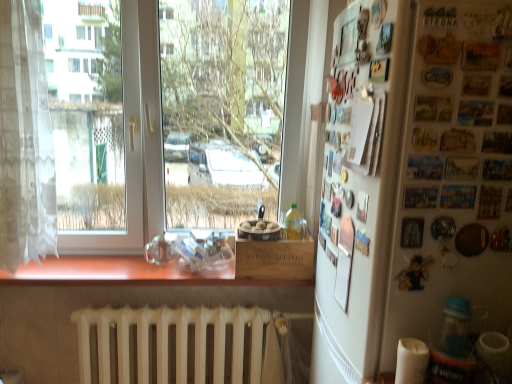
Question: Choose the correct answer: Is translucent plastic bottle at lower right, the 2th bottle when ordered from back to front, inside yellow translucent bottle at center, which is the second bottle in front-to-back order, or outside it?

Choices:
 (A) outside
 (B) inside

Answer: (A)

Question: From a real-world perspective, relative to yellow translucent bottle at center, marked as the first bottle in a back-to-front arrangement, is translucent plastic bottle at lower right, the first bottle positioned from the right, vertically above or below?

Choices:
 (A) below
 (B) above

Answer: (A)

Question: Which object is positioned farthest from the transparent glass window at center?

Choices:
 (A) white matte radiator at lower center
 (B) white matte refrigerator at right
 (C) translucent plastic bottle at lower right, the first bottle from the front
 (D) metallic silver magnets at right
 (E) white lace curtain at left

Answer: (C)

Question: Estimate the real-world distances between objects in this image. Which object is closer to the transparent glass window at center?

Choices:
 (A) white matte radiator at lower center
 (B) translucent plastic bottle at lower right, marked as the 2th bottle in a top-to-bottom arrangement
 (C) white matte refrigerator at right
 (D) white lace curtain at left
 (E) brown wood at center

Answer: (A)